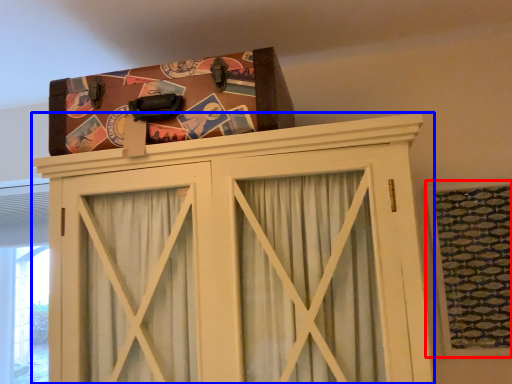
Question: Which object is further to the camera taking this photo, window (highlighted by a red box) or cupboard (highlighted by a blue box)?

Choices:
 (A) window
 (B) cupboard

Answer: (A)